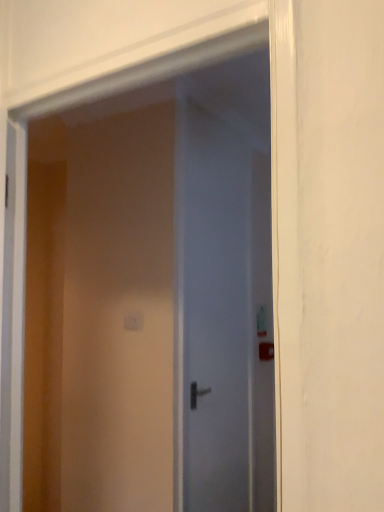
Question: Is white glossy door at center, which is the 2th door in back-to-front order, closer to camera compared to satin white door at center, which is the 1th door from back to front?

Choices:
 (A) yes
 (B) no

Answer: (A)

Question: Considering the relative positions of white glossy door at center, the first door positioned from the front, and satin white door at center, which is the second door from front to back, in the image provided, is white glossy door at center, the first door positioned from the front, to the right of satin white door at center, which is the second door from front to back, from the viewer's perspective?

Choices:
 (A) no
 (B) yes

Answer: (A)

Question: Is white glossy door at center, the first door positioned from the front, completely or partially outside of satin white door at center, which is the second door from front to back?

Choices:
 (A) no
 (B) yes

Answer: (B)

Question: Considering the relative positions of white glossy door at center, which is the 2th door in back-to-front order, and satin white door at center, which is the 1th door from back to front, in the image provided, is white glossy door at center, which is the 2th door in back-to-front order, behind satin white door at center, which is the 1th door from back to front,?

Choices:
 (A) no
 (B) yes

Answer: (A)

Question: Does white glossy door at center, which is the 2th door in back-to-front order, contain satin white door at center, which is the second door from front to back?

Choices:
 (A) no
 (B) yes

Answer: (A)

Question: Considering their positions, is white glossy door at center, which is the 2th door in back-to-front order, located in front of or behind white plastic light switch at center?

Choices:
 (A) front
 (B) behind

Answer: (A)

Question: From the image's perspective, is white glossy door at center, the first door positioned from the front, above or below white plastic light switch at center?

Choices:
 (A) below
 (B) above

Answer: (B)

Question: Based on their sizes in the image, would you say white glossy door at center, the first door positioned from the front, is bigger or smaller than white plastic light switch at center?

Choices:
 (A) big
 (B) small

Answer: (A)

Question: Is white glossy door at center, the first door positioned from the front, wider or thinner than white plastic light switch at center?

Choices:
 (A) thin
 (B) wide

Answer: (B)

Question: Considering the relative positions of white plastic light switch at center and satin white door at center, which is the second door from front to back, in the image provided, is white plastic light switch at center to the left or to the right of satin white door at center, which is the second door from front to back,?

Choices:
 (A) right
 (B) left

Answer: (B)

Question: From a real-world perspective, is white plastic light switch at center physically located above or below satin white door at center, which is the 1th door from back to front?

Choices:
 (A) below
 (B) above

Answer: (B)

Question: In terms of height, does white plastic light switch at center look taller or shorter compared to satin white door at center, which is the second door from front to back?

Choices:
 (A) tall
 (B) short

Answer: (B)

Question: Does point (132, 322) appear closer or farther from the camera than point (230, 270)?

Choices:
 (A) closer
 (B) farther

Answer: (A)

Question: From the image's perspective, relative to satin white door at center, which is the second door from front to back, is white glossy door at center, the first door positioned from the front, above or below?

Choices:
 (A) above
 (B) below

Answer: (A)

Question: Is white glossy door at center, which is the 2th door in back-to-front order, situated inside satin white door at center, which is the 1th door from back to front, or outside?

Choices:
 (A) outside
 (B) inside

Answer: (A)